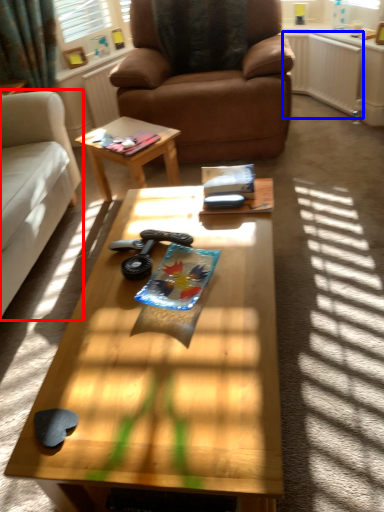
Question: Among these objects, which one is farthest to the camera, studio couch (highlighted by a red box) or radiator (highlighted by a blue box)?

Choices:
 (A) studio couch
 (B) radiator

Answer: (B)